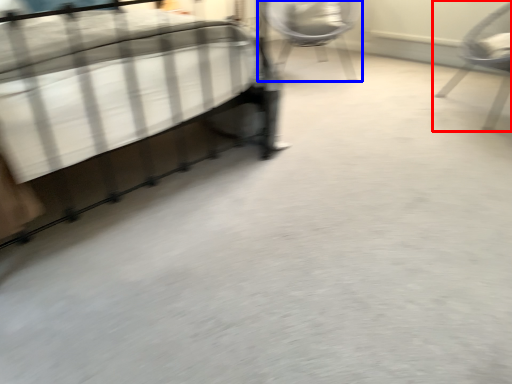
Question: Which point is further to the camera, chair (highlighted by a red box) or chair (highlighted by a blue box)?

Choices:
 (A) chair
 (B) chair

Answer: (B)